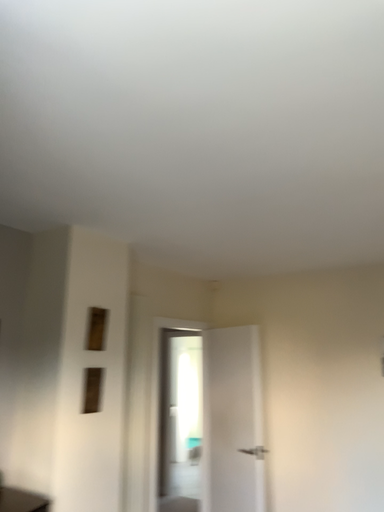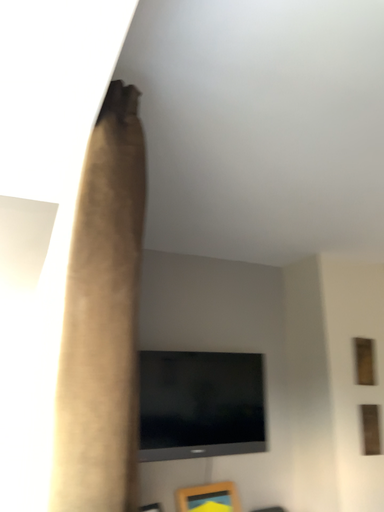
Question: Which way did the camera rotate in the video?

Choices:
 (A) rotated left
 (B) rotated right

Answer: (A)